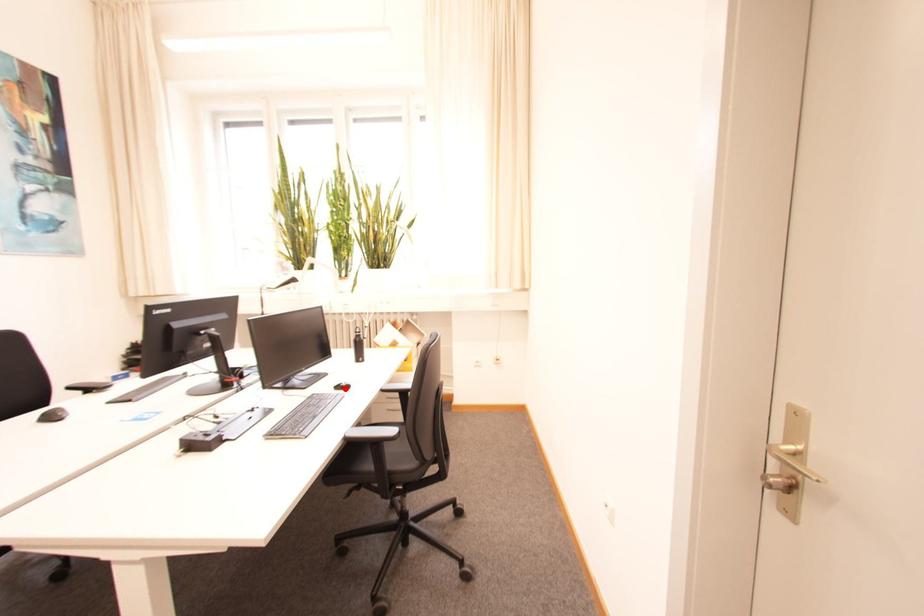
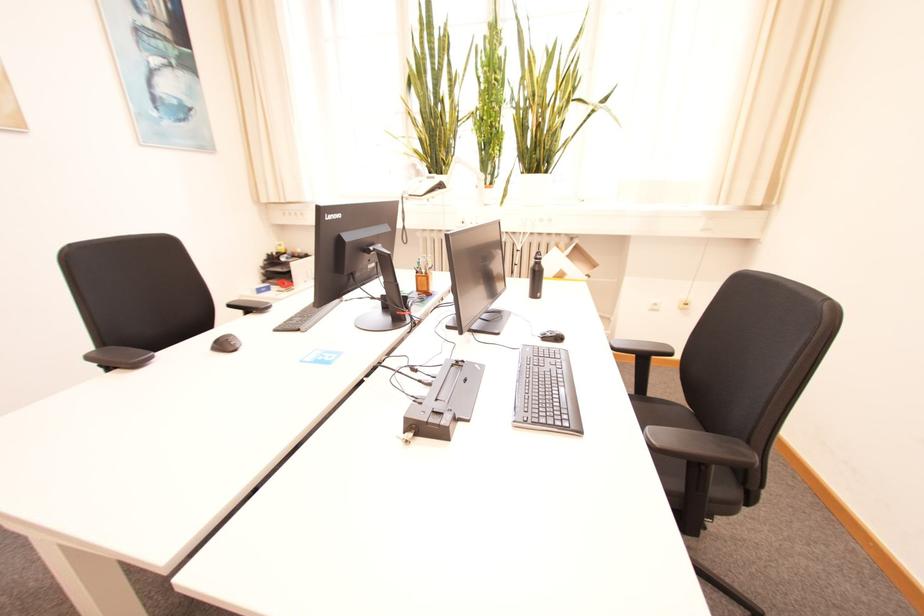
Where in the second image is the point corresponding to the highlighted location from the first image?

(551, 338)